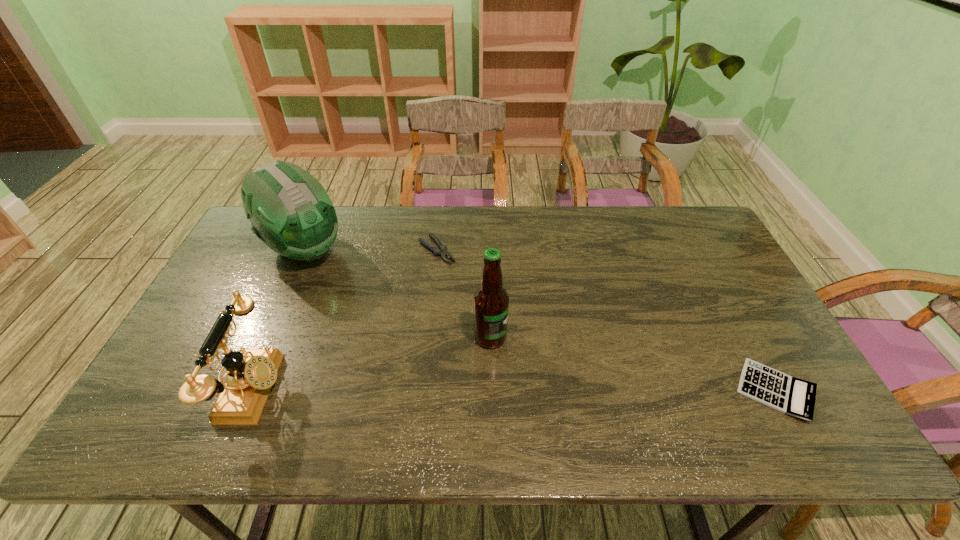
Find the location of a particular element. The width and height of the screenshot is (960, 540). free spot between the football helmet and the pliers is located at coordinates (371, 250).

What are the coordinates of `unoccupied area between the calculator and the third object from left to right` in the screenshot? It's located at (606, 320).

This screenshot has height=540, width=960. What are the coordinates of `vacant space that is in between the telephone and the pliers` in the screenshot? It's located at (346, 320).

Locate an element on the screen. This screenshot has width=960, height=540. free space between the rightmost object and the beer bottle is located at coordinates (633, 364).

This screenshot has width=960, height=540. In order to click on empty space between the calculator and the football helmet in this screenshot , I will do `click(540, 320)`.

In order to click on vacant area between the pliers and the second object from right to left in this screenshot , I will do (464, 294).

You are a GUI agent. You are given a task and a screenshot of the screen. Output one action in this format:
    pyautogui.click(x=<x>, y=<y>)
    Task: Click on the vacant point located between the pliers and the football helmet
    
    Given the screenshot: What is the action you would take?
    [371, 250]

The height and width of the screenshot is (540, 960). Identify the location of free space between the calculator and the football helmet. (540, 320).

At what (x,y) coordinates should I click in order to perform the action: click on empty space between the pliers and the third tallest object. Please return your answer as a coordinate pair (x, y). This screenshot has width=960, height=540. Looking at the image, I should click on (346, 320).

Where is `object that stands as the third closest to the football helmet`? Image resolution: width=960 pixels, height=540 pixels. object that stands as the third closest to the football helmet is located at coordinates (491, 301).